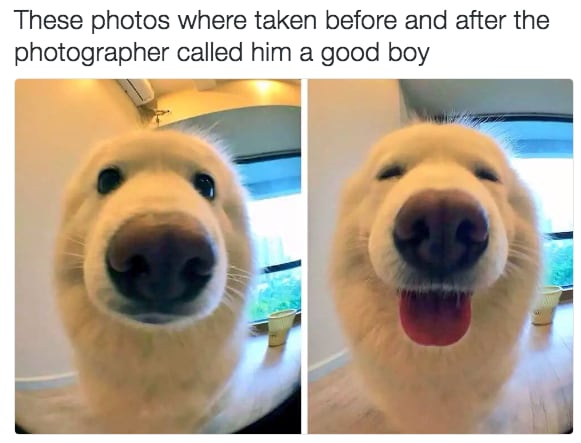
Locate an element on the screen. cup is located at coordinates (284, 328), (550, 312).